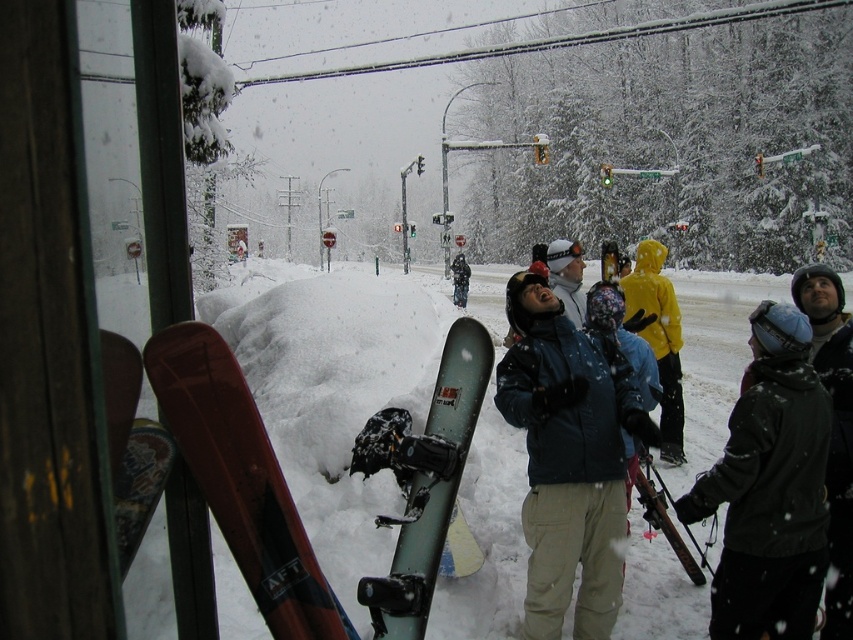
Question: Is matte red snowboard at left bigger than matte black snowboard at center?

Choices:
 (A) yes
 (B) no

Answer: (B)

Question: Can you confirm if matte blue jacket at center is positioned to the right of matte black snowboard at center?

Choices:
 (A) no
 (B) yes

Answer: (B)

Question: Which is nearer to the matte black snowboard at center?

Choices:
 (A) yellow matte jacket at center
 (B) matte blue jacket at center
 (C) dark gray jacket at right

Answer: (A)

Question: Among these points, which one is farthest from the camera?

Choices:
 (A) (457, 266)
 (B) (352, 371)
 (C) (618, 540)
 (D) (665, 356)

Answer: (A)

Question: Is white fluffy snow at center to the left of matte blue jacket at center from the viewer's perspective?

Choices:
 (A) no
 (B) yes

Answer: (A)

Question: Which of these objects is positioned farthest from the patterned wood snowboard at lower left?

Choices:
 (A) matte red snowboard at left
 (B) green matte snowboard at center
 (C) matte black snowboard at center
 (D) dark gray jacket at right

Answer: (C)